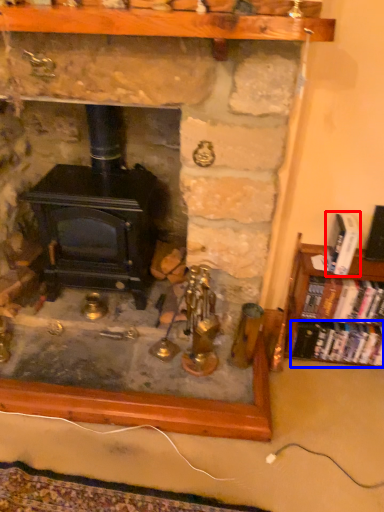
Question: Which of the following is the closest to the observer, book (highlighted by a red box) or book (highlighted by a blue box)?

Choices:
 (A) book
 (B) book

Answer: (A)